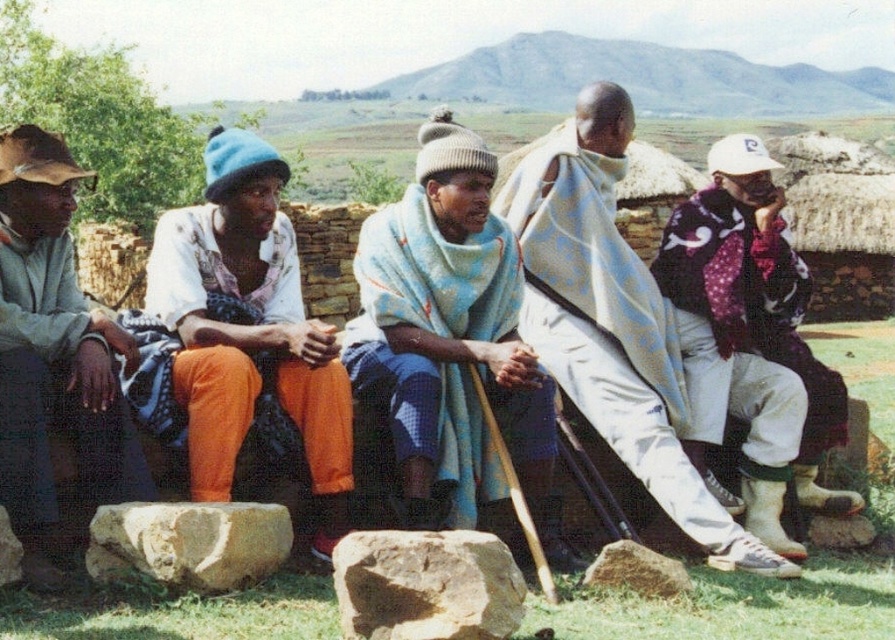
You are standing at the origin point in the image. Which object is located at the coordinates point (192,541)?

The point (192,541) corresponds to the smooth beige rock at lower left.

You are organizing a picnic and need to place the blue woolen blanket at center and the white woven blanket at center. According to the scene, which blanket is positioned higher?

The white woven blanket at center is positioned higher than the blue woolen blanket at center.

Looking at this image, you are organizing a picnic and need to place the blue woolen blanket at center and the white woven blanket at center on the grass. According to the scene, which blanket is positioned to the left when viewed from your perspective?

The blue woolen blanket at center is positioned to the left of the white woven blanket at center.